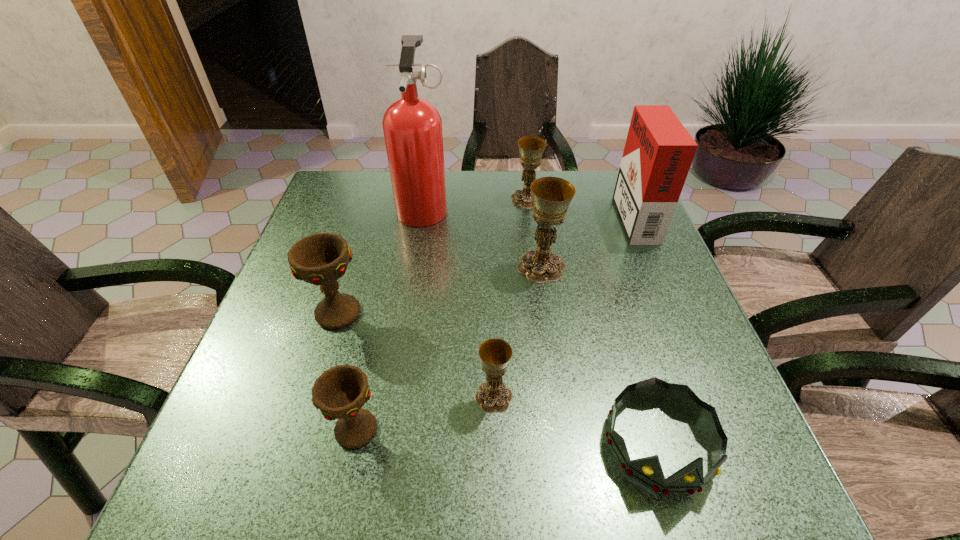
At what (x,y) coordinates should I click in order to perform the action: click on vacant space located on the right of the leftmost gold chalice. Please return your answer as a coordinate pair (x, y). This screenshot has height=540, width=960. Looking at the image, I should click on (611, 397).

This screenshot has width=960, height=540. What are the coordinates of `vacant space situated 0.340m on the right of the nearer red chalice` in the screenshot? It's located at (577, 429).

Where is `fire extinguisher at the far edge`? The width and height of the screenshot is (960, 540). fire extinguisher at the far edge is located at coordinates (412, 126).

You are a GUI agent. You are given a task and a screenshot of the screen. Output one action in this format:
    pyautogui.click(x=<x>, y=<y>)
    Task: Click on the cigarette case that is at the far edge
    The image size is (960, 540).
    Given the screenshot: What is the action you would take?
    pyautogui.click(x=658, y=153)

The image size is (960, 540). In order to click on chalice that is positioned at the far edge in this screenshot , I will do `click(531, 148)`.

Find the location of a particular element. Image resolution: width=960 pixels, height=540 pixels. chalice that is at the near edge is located at coordinates [x=340, y=392].

Find the location of a particular element. The image size is (960, 540). tiara positioned at the near edge is located at coordinates (648, 471).

Where is `object located in the left edge section of the desktop`? This screenshot has width=960, height=540. object located in the left edge section of the desktop is located at coordinates (321, 259).

Find the location of `cigarette case present at the right edge`. cigarette case present at the right edge is located at coordinates (658, 153).

This screenshot has width=960, height=540. In order to click on tiara at the right edge in this screenshot , I will do `click(648, 471)`.